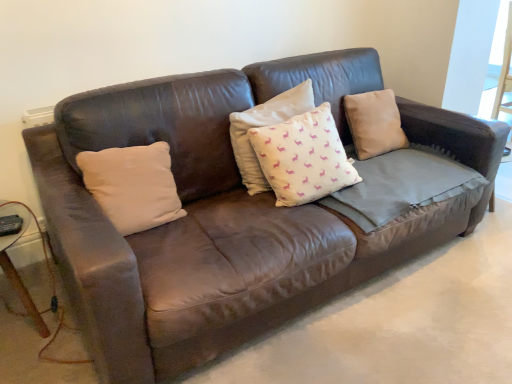
Question: In which direction should I rotate to look at white cotton cushion at center, which is the 2th pillow from left to right?

Choices:
 (A) right
 (B) left

Answer: (A)

Question: Is white matte pillow at center, the 3th pillow in the right-to-left sequence, further to camera compared to brown leather pillow at upper right, which is the third pillow from left to right?

Choices:
 (A) no
 (B) yes

Answer: (A)

Question: Can you confirm if white matte pillow at center, acting as the first pillow starting from the left, is taller than brown leather pillow at upper right, arranged as the 1th pillow when viewed from the right?

Choices:
 (A) no
 (B) yes

Answer: (A)

Question: Is white matte pillow at center, acting as the first pillow starting from the left, wider than brown leather pillow at upper right, which is the third pillow from left to right?

Choices:
 (A) no
 (B) yes

Answer: (A)

Question: Is white matte pillow at center, the 3th pillow in the right-to-left sequence, to the left of brown leather pillow at upper right, arranged as the 1th pillow when viewed from the right, from the viewer's perspective?

Choices:
 (A) yes
 (B) no

Answer: (A)

Question: From the image's perspective, is white matte pillow at center, the 3th pillow in the right-to-left sequence, over brown leather pillow at upper right, which is the third pillow from left to right?

Choices:
 (A) yes
 (B) no

Answer: (B)

Question: Is white matte pillow at center, acting as the first pillow starting from the left, facing away from brown leather pillow at upper right, which is the third pillow from left to right?

Choices:
 (A) no
 (B) yes

Answer: (A)

Question: Considering the relative sizes of white matte pillow at center, the 3th pillow in the right-to-left sequence, and wooden side table at lower left in the image provided, is white matte pillow at center, the 3th pillow in the right-to-left sequence, smaller than wooden side table at lower left?

Choices:
 (A) no
 (B) yes

Answer: (B)

Question: Is white matte pillow at center, the 3th pillow in the right-to-left sequence, not close to wooden side table at lower left?

Choices:
 (A) no
 (B) yes

Answer: (A)

Question: Considering the relative sizes of white matte pillow at center, the 3th pillow in the right-to-left sequence, and wooden side table at lower left in the image provided, is white matte pillow at center, the 3th pillow in the right-to-left sequence, thinner than wooden side table at lower left?

Choices:
 (A) yes
 (B) no

Answer: (A)

Question: Is white matte pillow at center, acting as the first pillow starting from the left, wider than wooden side table at lower left?

Choices:
 (A) no
 (B) yes

Answer: (A)

Question: Can you confirm if white matte pillow at center, the 3th pillow in the right-to-left sequence, is taller than wooden side table at lower left?

Choices:
 (A) yes
 (B) no

Answer: (B)

Question: From the image's perspective, is white matte pillow at center, acting as the first pillow starting from the left, above wooden side table at lower left?

Choices:
 (A) no
 (B) yes

Answer: (B)

Question: Is white matte pillow at center, acting as the first pillow starting from the left, turned away from white cotton cushion at center, acting as the 2th pillow starting from the right?

Choices:
 (A) yes
 (B) no

Answer: (B)